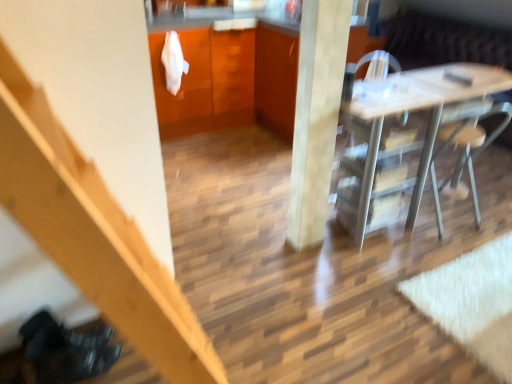
Where is `vacant space in between wooden stairs at left and smooth light wood pillar at center`? vacant space in between wooden stairs at left and smooth light wood pillar at center is located at coordinates (266, 300).